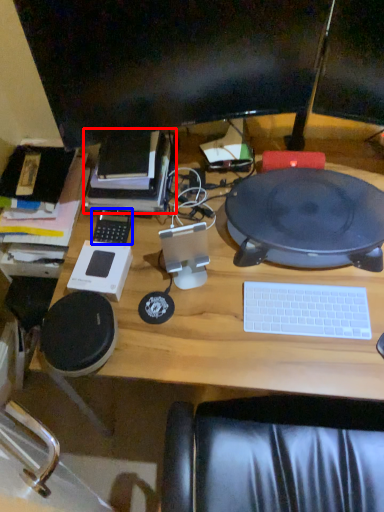
Question: Which of the following is the closest to the observer, book (highlighted by a red box) or gadget (highlighted by a blue box)?

Choices:
 (A) book
 (B) gadget

Answer: (A)